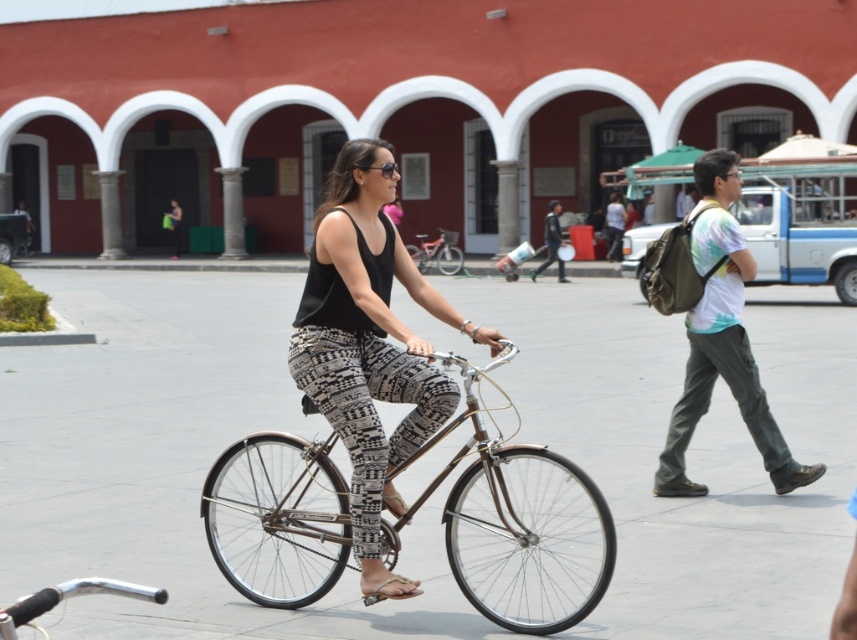
Question: Among these objects, which one is farthest from the camera?

Choices:
 (A) matte black tank top at center
 (B) shiny metallic bicycle at center
 (C) light blue tie-dye shirt at right

Answer: (A)

Question: Which object appears closest to the camera in this image?

Choices:
 (A) black matte tank top at center
 (B) shiny chrome bicycle at center
 (C) shiny metallic bicycle at center

Answer: (B)

Question: Estimate the real-world distances between objects in this image. Which object is closer to the light blue tie-dye shirt at right?

Choices:
 (A) shiny metallic bicycle at center
 (B) light blue tie-dye shirt at center

Answer: (A)

Question: Is shiny chrome bicycle at center closer to camera compared to light blue tie-dye shirt at right?

Choices:
 (A) no
 (B) yes

Answer: (B)

Question: In this image, where is light blue tie-dye shirt at right located relative to light blue tie-dye shirt at center?

Choices:
 (A) right
 (B) left

Answer: (B)

Question: Is black matte tank top at center to the right of shiny metallic bicycle at center from the viewer's perspective?

Choices:
 (A) yes
 (B) no

Answer: (B)